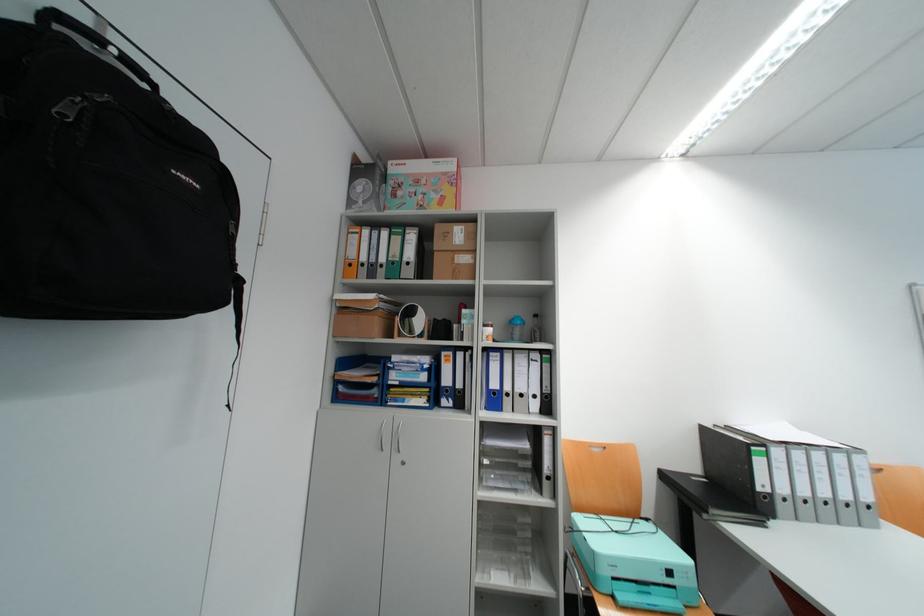
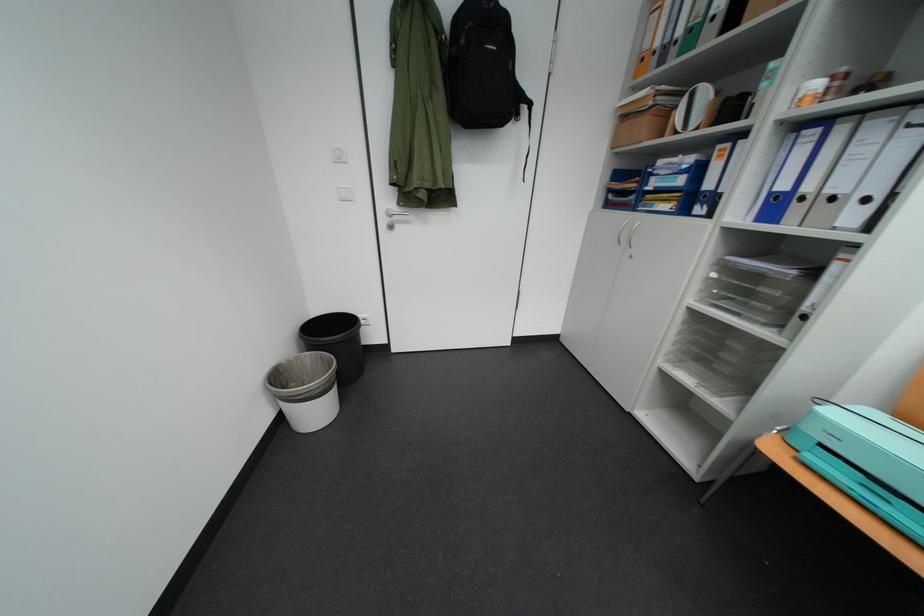
How did the camera likely rotate?

The rotation direction of the camera is left-down.